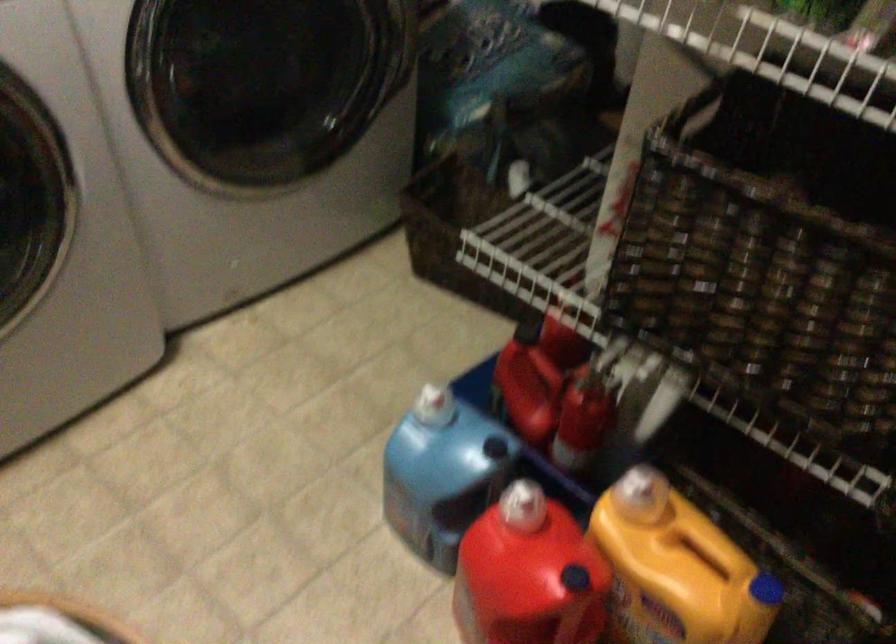
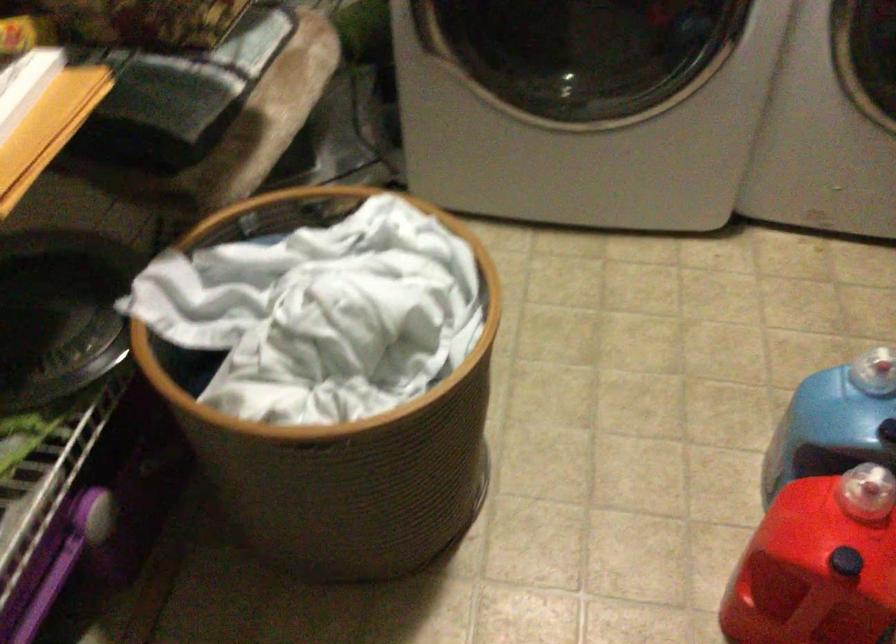
Find the pixel in the second image that matches point (428, 409) in the first image.

(872, 373)